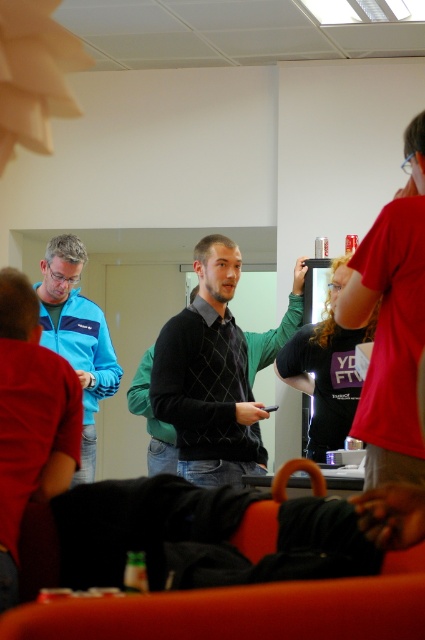
Question: Can you confirm if matte black sweater at center is positioned above blue fabric jacket at left?

Choices:
 (A) yes
 (B) no

Answer: (A)

Question: Does matte black sweater at center appear under dark gray sweater at center?

Choices:
 (A) no
 (B) yes

Answer: (A)

Question: Which point appears farthest from the camera in this image?

Choices:
 (A) (96, 310)
 (B) (410, 353)

Answer: (A)

Question: Does dark gray sweater at center come in front of blue fabric jacket at left?

Choices:
 (A) yes
 (B) no

Answer: (A)

Question: Which point appears closest to the camera in this image?

Choices:
 (A) (116, 364)
 (B) (178, 337)

Answer: (B)

Question: Estimate the real-world distances between objects in this image. Which object is farther from the dark gray sweater at center?

Choices:
 (A) matte black sweater at center
 (B) blue fabric jacket at left

Answer: (A)